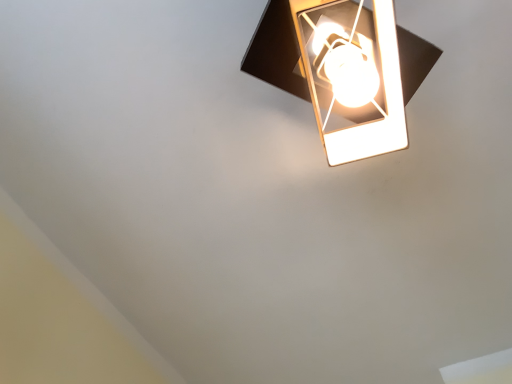
Where is `matte black lamp at upper right`? matte black lamp at upper right is located at coordinates (344, 69).

Image resolution: width=512 pixels, height=384 pixels. Describe the element at coordinates (344, 69) in the screenshot. I see `matte black lamp at upper right` at that location.

In order to click on matte black lamp at upper right in this screenshot , I will do `click(344, 69)`.